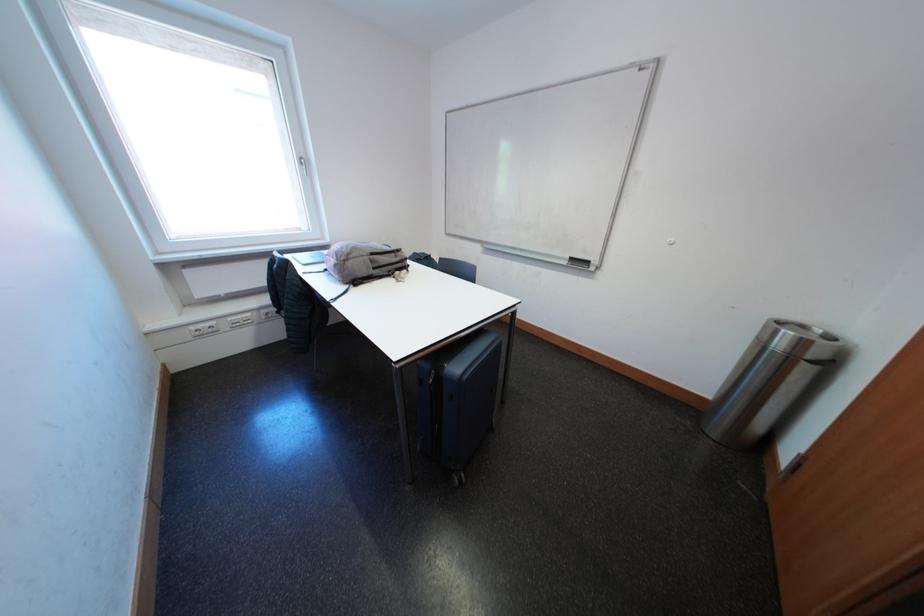
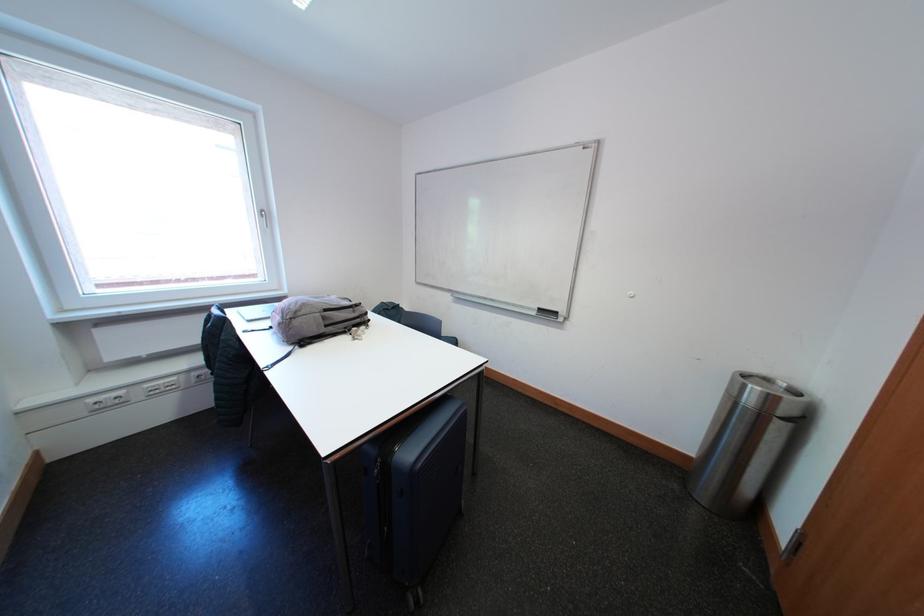
Question: The images are taken continuously from a first-person perspective. In which direction is your viewpoint rotating?

Choices:
 (A) Left
 (B) Right
 (C) Up
 (D) Down

Answer: (C)